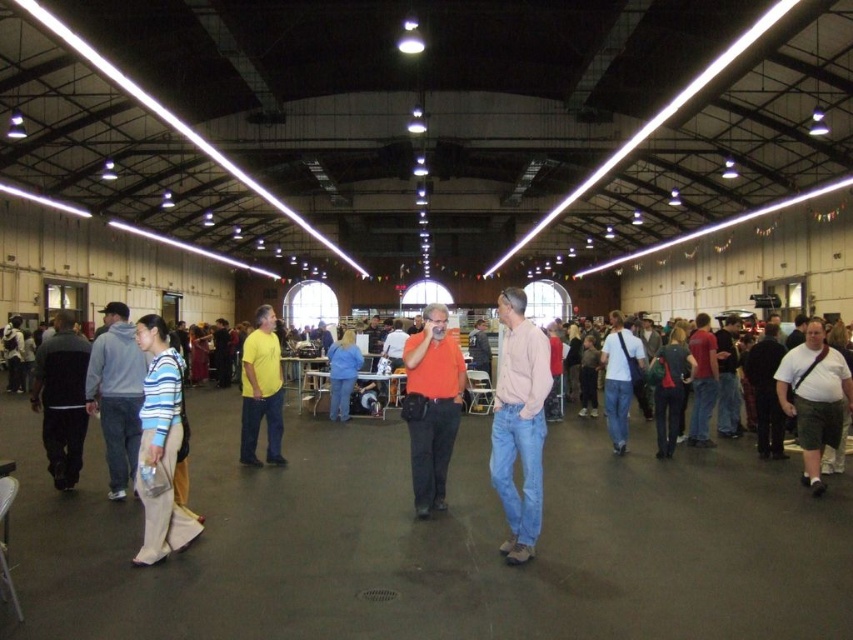
Is point (804, 454) more distant than point (345, 397)?

No, it is in front of (345, 397).

Based on the photo, which of these two, fat man in shorts at right or blue denim jeans at center, stands shorter?

blue denim jeans at center is shorter.

Between point (842, 419) and point (347, 371), which one is positioned behind?

Point (347, 371)

Where is `fat man in shorts at right`? This screenshot has height=640, width=853. fat man in shorts at right is located at coordinates (814, 397).

Does gray fleece jacket at left have a smaller size compared to dark gray pants at left?

Actually, gray fleece jacket at left might be larger than dark gray pants at left.

This screenshot has height=640, width=853. What do you see at coordinates (115, 394) in the screenshot?
I see `gray fleece jacket at left` at bounding box center [115, 394].

Which is in front, point (140, 397) or point (74, 476)?

Point (140, 397)

In order to click on gray fleece jacket at left in this screenshot , I will do (x=115, y=394).

Does pink cotton shirt at center have a lesser height compared to orange matte shirt at center?

No, pink cotton shirt at center is not shorter than orange matte shirt at center.

Is pink cotton shirt at center thinner than orange matte shirt at center?

No, pink cotton shirt at center is not thinner than orange matte shirt at center.

This screenshot has width=853, height=640. Describe the element at coordinates (519, 422) in the screenshot. I see `pink cotton shirt at center` at that location.

I want to click on pink cotton shirt at center, so click(519, 422).